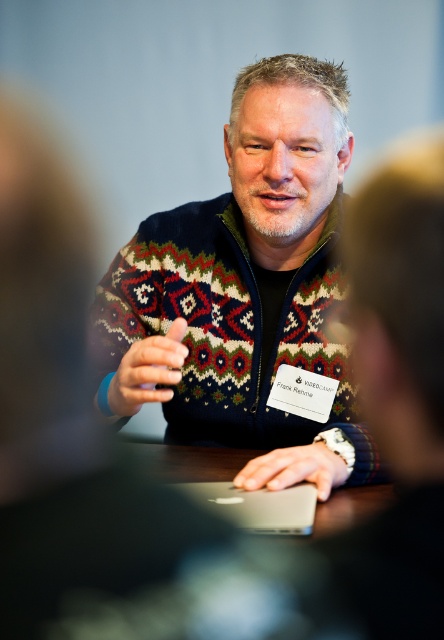
You are a photographer who needs to capture a closeup shot of the knitted sweater at center and the satin silver mouse at center. Which object should you focus on first to ensure both are in frame without moving the camera?

The knitted sweater at center is much taller than the satin silver mouse at center, so you should focus on the knitted sweater at center first to ensure it fits within the frame before adjusting for the smaller mouse.

You are a photographer positioned to take a closeup shot of the knitted sweater at center and the satin silver mouse at center. Which object will appear larger in your photo?

The knitted sweater at center will appear larger in the photo because it is closer to the viewer than the satin silver mouse at center.

You are a photographer at the event. You need to take a photo of Frank Rehme and his laptop. The camera you are using has a focus range that can only capture objects taller than 10 cm. Can the camera focus on both the silver metallic laptop at center and the matte black hand at center?

The silver metallic laptop at center has a lesser height compared to matte black hand at center. Since the camera requires objects taller than 10 cm, and the laptop is shorter than the hand, but we don not know the exact height of either, we cannot determine if both meet the requirement. However, if the hand is taller than 10 cm, the laptop might be shorter but still possibly above 10 cm. Without specific measurements, it is uncertain.